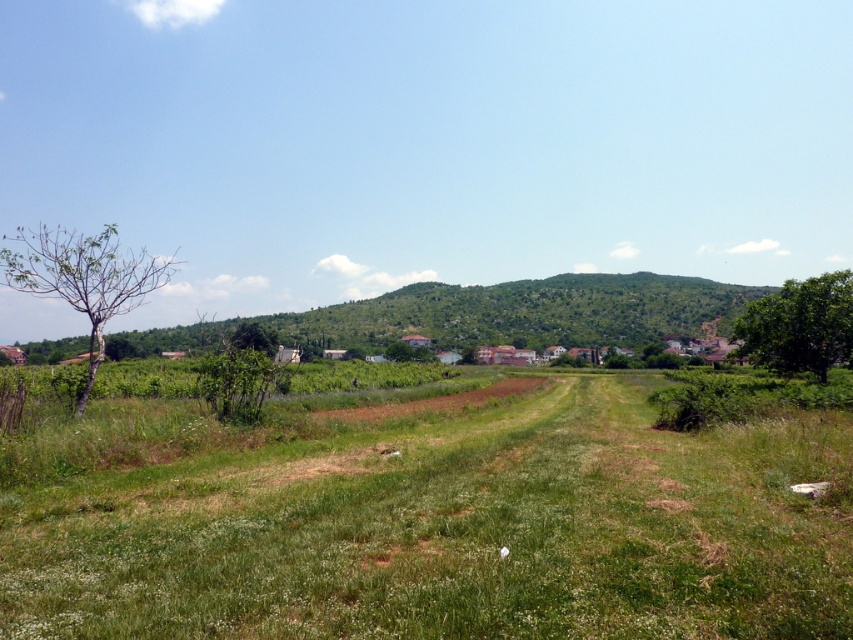
Question: Is green grassy field at center thinner than green leafy tree at right?

Choices:
 (A) yes
 (B) no

Answer: (B)

Question: Among these points, which one is farthest from the camera?

Choices:
 (A) click(x=740, y=324)
 (B) click(x=48, y=262)

Answer: (A)

Question: Does bare wood tree at left have a smaller size compared to green leafy tree at right?

Choices:
 (A) no
 (B) yes

Answer: (A)

Question: Which of the following is the farthest from the observer?

Choices:
 (A) (753, 433)
 (B) (79, 250)

Answer: (B)

Question: Does green grassy field at center have a larger size compared to bare wood tree at left?

Choices:
 (A) yes
 (B) no

Answer: (B)

Question: Among these objects, which one is farthest from the camera?

Choices:
 (A) green leafy tree at right
 (B) green grassy field at center
 (C) bare wood tree at left

Answer: (A)